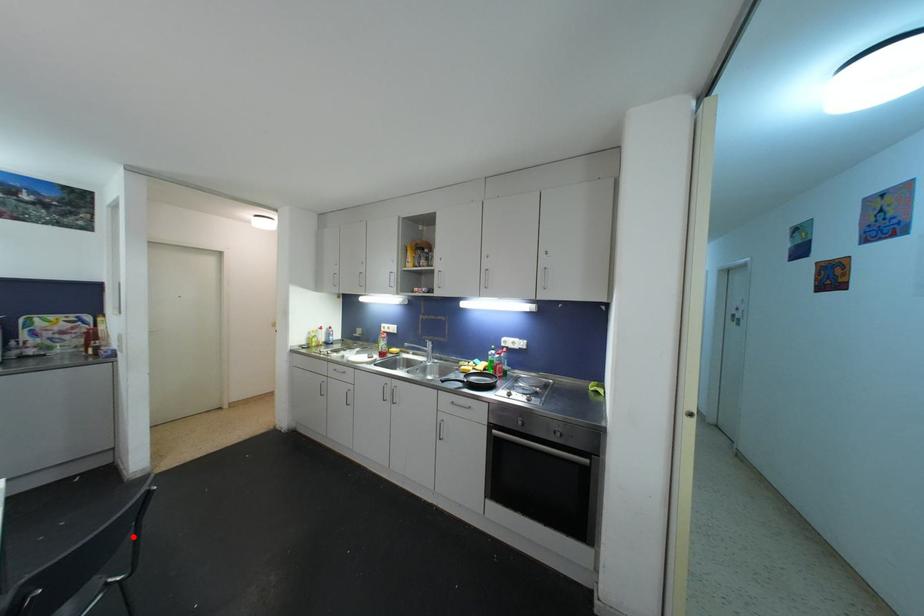
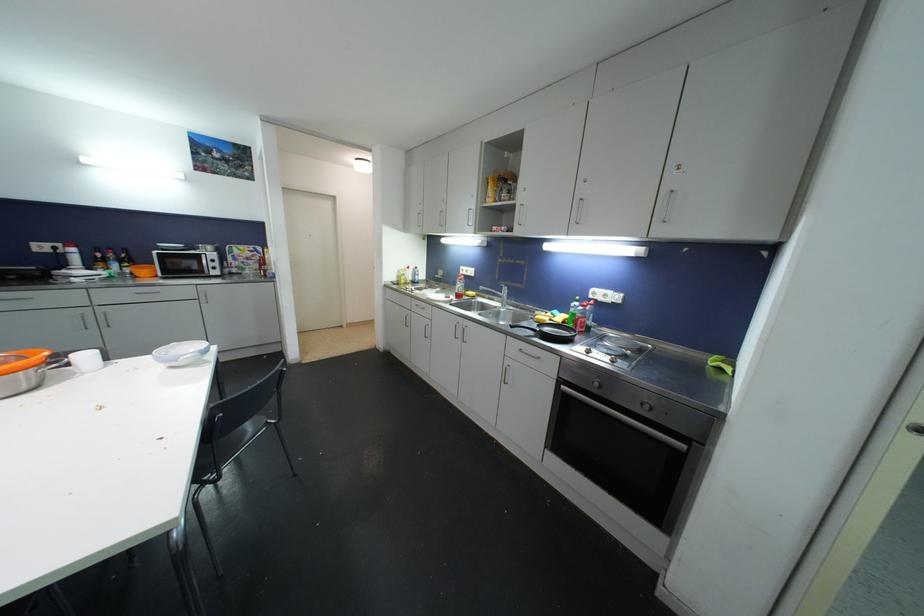
Question: A red point is marked in image1. In image2, is the corresponding 3D point closer to the camera or farther? Reply with the corresponding letter.

Choices:
 (A) The corresponding 3D point is closer.
 (B) The corresponding 3D point is farther.

Answer: (A)